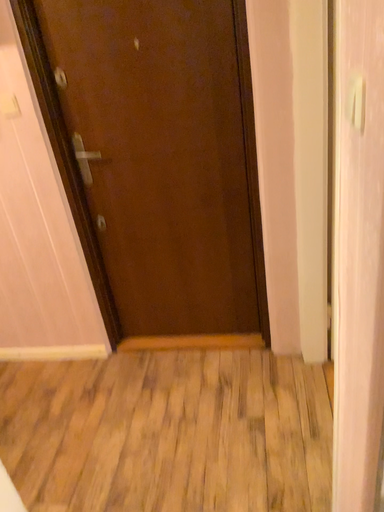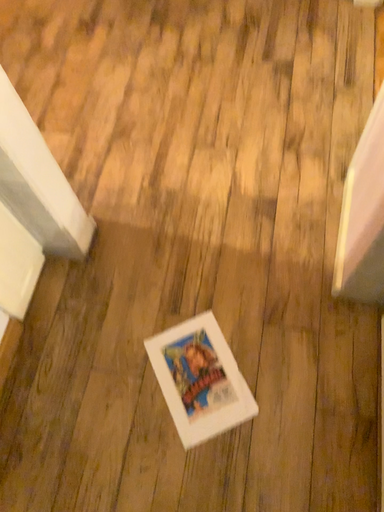
Question: How did the camera likely rotate when shooting the video?

Choices:
 (A) rotated upward
 (B) rotated downward

Answer: (B)